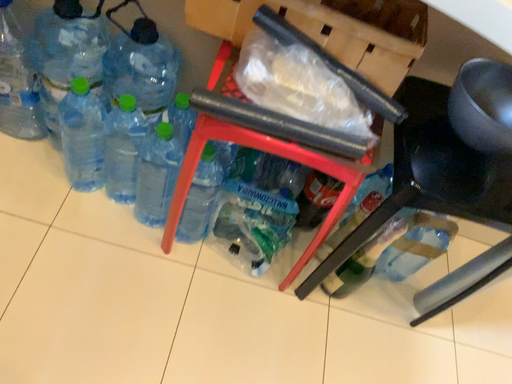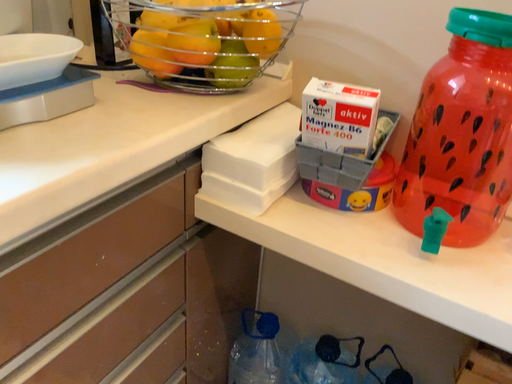
Question: Which way did the camera rotate in the video?

Choices:
 (A) rotated right
 (B) rotated left

Answer: (B)